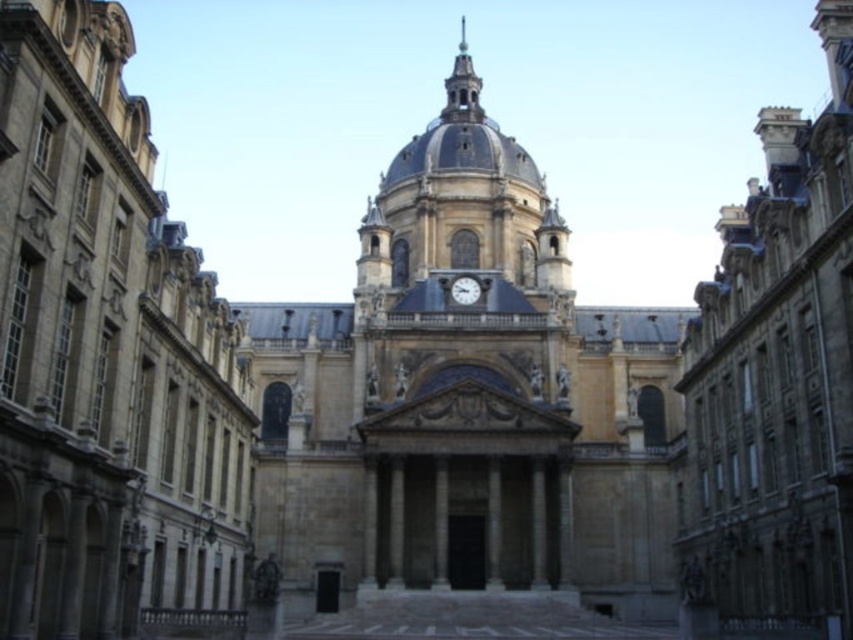
Looking at this image, who is shorter, polished copper spire at upper center or metallic gray clock at center?

metallic gray clock at center

Is polished copper spire at upper center smaller than metallic gray clock at center?

No, polished copper spire at upper center is not smaller than metallic gray clock at center.

What are the coordinates of `polished copper spire at upper center` in the screenshot? It's located at (462, 88).